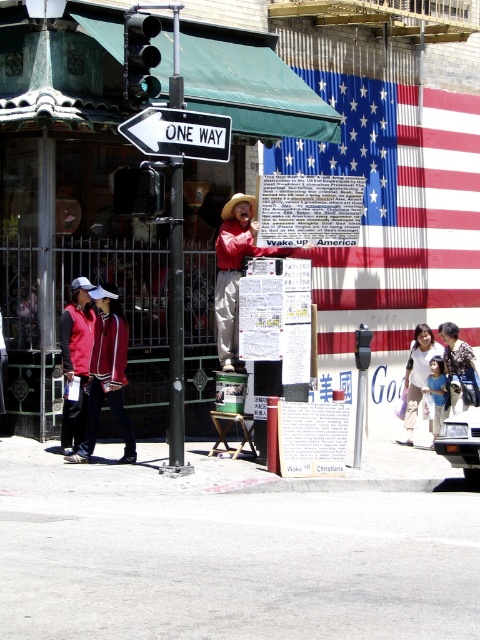
You are a painter hired to cover the blue corrugated metal flag at upper center and the green glass traffic light at upper left with protective paper. If the paper you have is only wide enough to cover the narrower of the two, which object should you cover first?

The green glass traffic light at upper left is narrower than the blue corrugated metal flag at upper center, so you should cover the green glass traffic light at upper left first with the paper since it is narrower and fits the width of the available paper.

You are a pedestrian standing in front of the metallic pole at center. You want to cross the street to reach the large American flag painted on the wall behind the man. Given that the safe crossing distance is 15 meters, can you safely cross the street?

The metallic pole at center is 12.05 meters away from the viewer. Since the safe crossing distance is 15 meters, you can safely cross the street as the distance is within the safe limit.